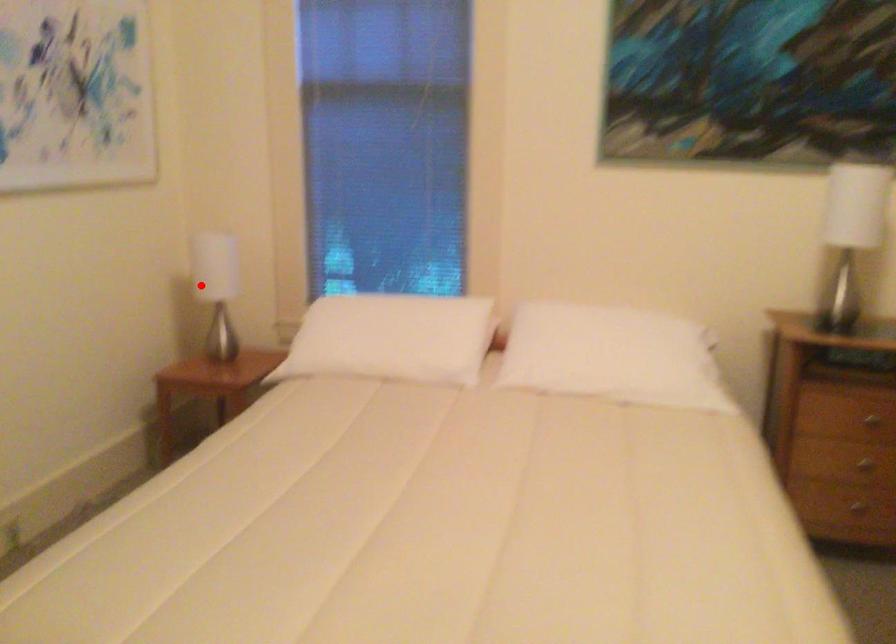
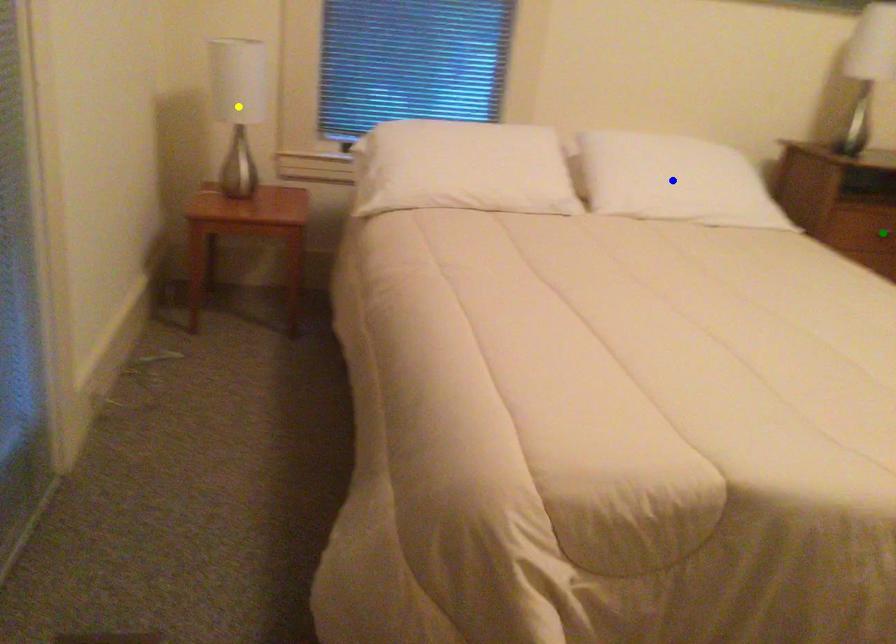
Question: I am providing you with two images of the same scene from different viewpoints. A red point is marked on the first image. You are given multiple points on the second image. Which point in image 2 represents the same 3d spot as the red point in image 1?

Choices:
 (A) yellow point
 (B) green point
 (C) blue point

Answer: (A)